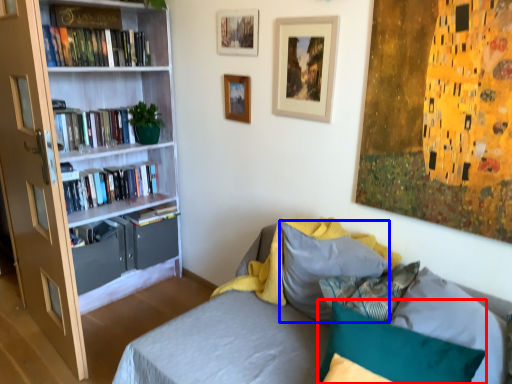
Question: Which object is closer to the camera taking this photo, pillow (highlighted by a red box) or pillow (highlighted by a blue box)?

Choices:
 (A) pillow
 (B) pillow

Answer: (A)